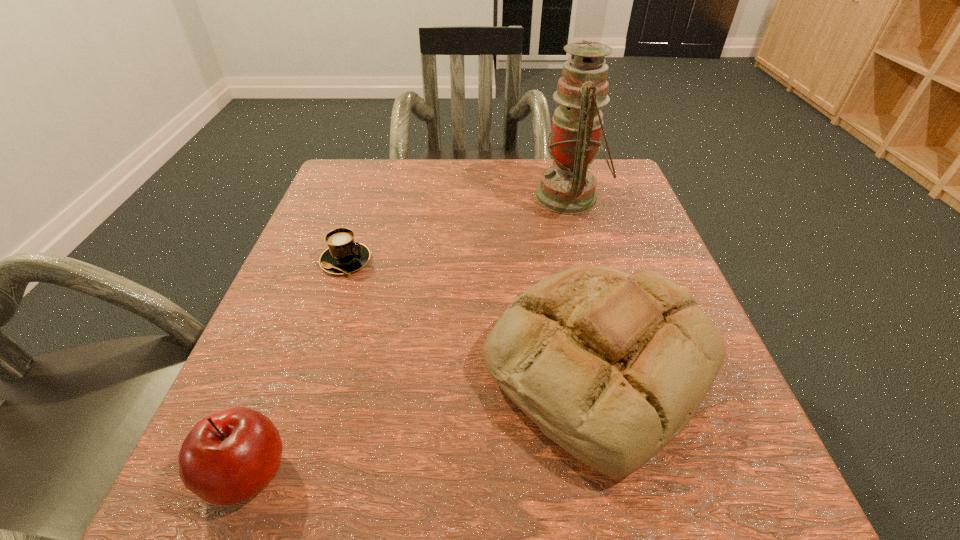
This screenshot has height=540, width=960. Identify the location of object that is at the far edge. (569, 187).

Image resolution: width=960 pixels, height=540 pixels. In order to click on bread at the near edge in this screenshot , I will do `click(611, 366)`.

You are a GUI agent. You are given a task and a screenshot of the screen. Output one action in this format:
    pyautogui.click(x=<x>, y=<y>)
    Task: Click on the apple located at the near edge
    This screenshot has height=540, width=960.
    Given the screenshot: What is the action you would take?
    pyautogui.click(x=228, y=457)

Where is `apple that is at the left edge`? apple that is at the left edge is located at coordinates coord(228,457).

Locate an element on the screen. This screenshot has height=540, width=960. cappuccino positioned at the left edge is located at coordinates (344, 256).

Locate an element on the screen. The image size is (960, 540). oil lamp that is at the right edge is located at coordinates (569, 187).

I want to click on bread that is at the right edge, so click(x=611, y=366).

Where is `object present at the near left corner`? The height and width of the screenshot is (540, 960). object present at the near left corner is located at coordinates (228, 457).

Where is `object located at the far right corner`? This screenshot has height=540, width=960. object located at the far right corner is located at coordinates (569, 187).

This screenshot has width=960, height=540. I want to click on object that is positioned at the near right corner, so click(611, 366).